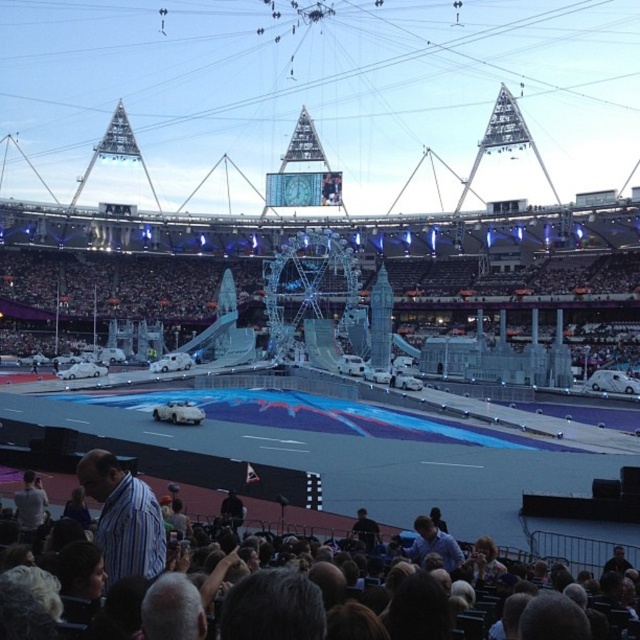
You are an event organizer at the stadium and need to ensure that the dark hair at lower center and the striped cotton shirt at lower left can hear the announcements. The sound system has an effective range of 30 feet. Can both individuals within the sound system range?

The distance between dark hair at lower center and striped cotton shirt at lower left is 28.37 feet, which is within the 30 feet effective range of the sound system. Therefore, both individuals can hear the announcements.

You are a photographer at the event and want to capture both the dark hair at lower center and the striped cotton shirt at lower left in a single frame. Which object should you focus on first to ensure both are in the frame?

You should focus on the dark hair at lower center first because its width is larger than the striped cotton shirt at lower left, so centering it will allow the smaller striped cotton shirt at lower left to fit into the frame more easily.